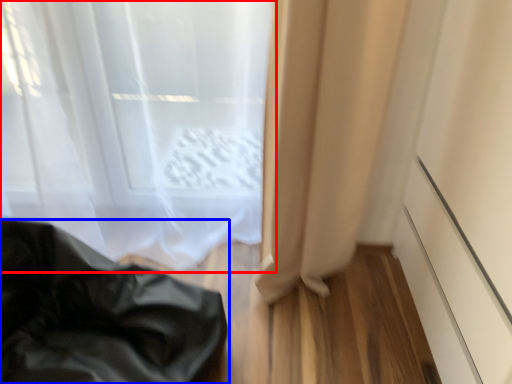
Question: Which object appears farthest to the camera in this image, curtain (highlighted by a red box) or furniture (highlighted by a blue box)?

Choices:
 (A) curtain
 (B) furniture

Answer: (A)